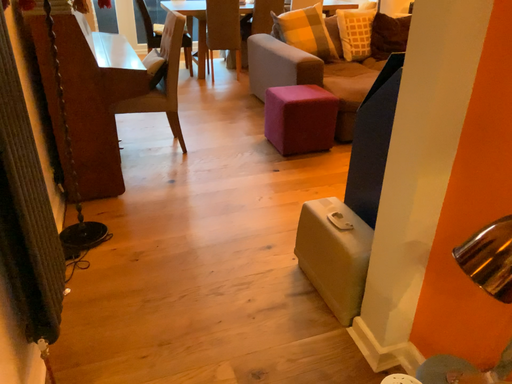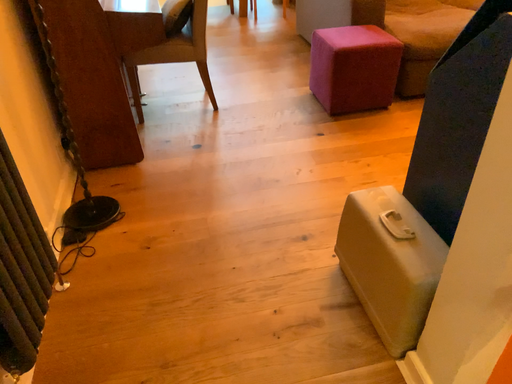
Question: How did the camera likely rotate when shooting the video?

Choices:
 (A) rotated right
 (B) rotated left

Answer: (B)